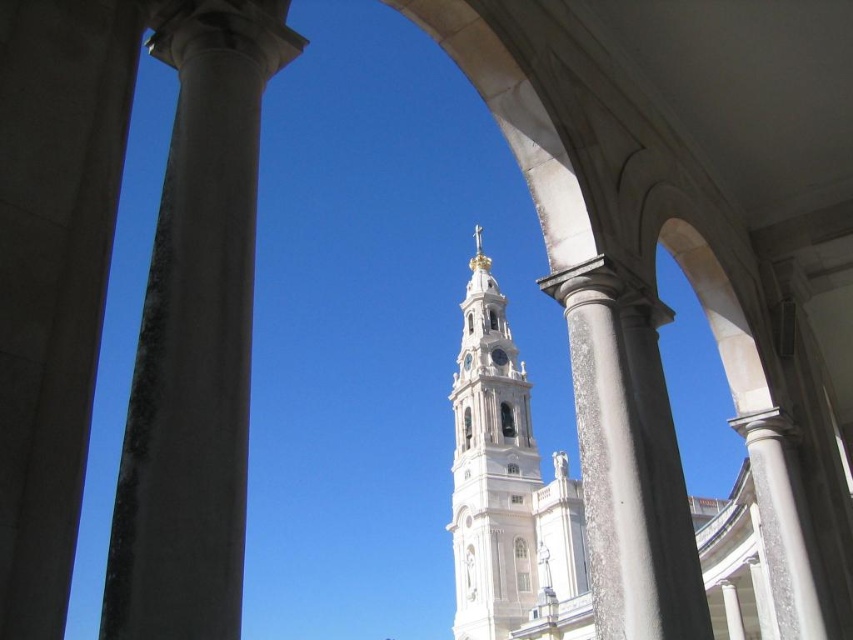
Question: Can you confirm if white stone column at left is positioned to the right of white stone tower at center?

Choices:
 (A) yes
 (B) no

Answer: (B)

Question: Which point is farther to the camera?

Choices:
 (A) white stone column at left
 (B) white marble column at left
 (C) white stone tower at center
 (D) white marble column at center

Answer: (C)

Question: Can you confirm if white marble column at center is positioned to the left of white stone tower at center?

Choices:
 (A) no
 (B) yes

Answer: (B)

Question: Which object appears farthest from the camera in this image?

Choices:
 (A) white stone column at left
 (B) white marble column at center
 (C) white marble column at left
 (D) white stone tower at center

Answer: (D)

Question: Which point is closer to the camera?

Choices:
 (A) white marble column at center
 (B) white marble column at left
 (C) white stone column at left

Answer: (C)

Question: Is white stone column at left bigger than white marble column at center?

Choices:
 (A) no
 (B) yes

Answer: (A)